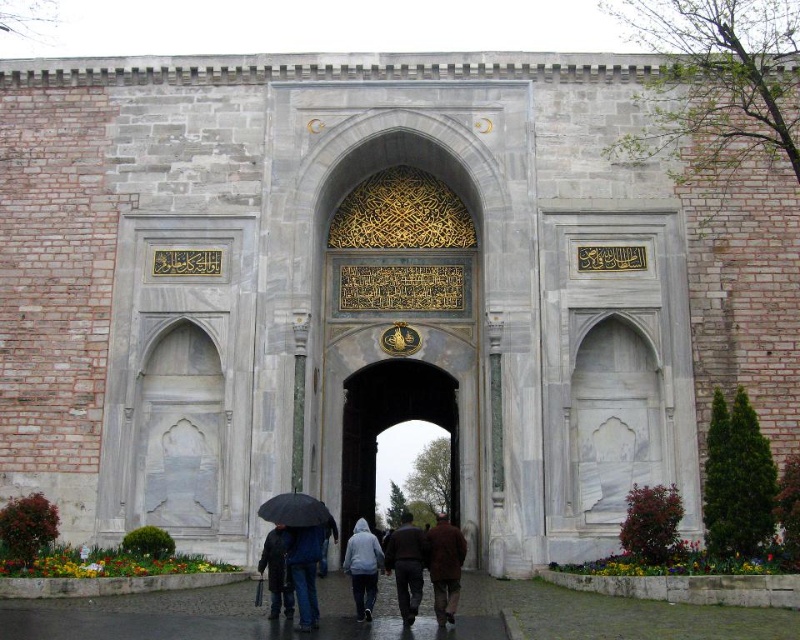
Does point (278, 600) lie in front of point (316, 524)?

No, it is behind (316, 524).

Can you confirm if dark brown leather coat at lower center is thinner than black matte umbrella at lower center?

Yes, dark brown leather coat at lower center is thinner than black matte umbrella at lower center.

Between point (286, 548) and point (277, 499), which one is positioned in front?

Point (286, 548) is more forward.

Image resolution: width=800 pixels, height=640 pixels. Identify the location of dark brown leather coat at lower center. (277, 572).

Does point (458, 381) lie behind point (310, 545)?

That is True.

Between gold metallic gate at center and dark blue jeans at center, which one has more height?

With more height is gold metallic gate at center.

The width and height of the screenshot is (800, 640). What are the coordinates of `gold metallic gate at center` in the screenshot? It's located at (390, 426).

Image resolution: width=800 pixels, height=640 pixels. What are the coordinates of `gold metallic gate at center` in the screenshot? It's located at (390, 426).

Who is higher up, brown leather jacket at center or light gray hoodie at center?

light gray hoodie at center

Which of these two, brown leather jacket at center or light gray hoodie at center, stands shorter?

Standing shorter between the two is light gray hoodie at center.

Describe the element at coordinates (444, 566) in the screenshot. I see `brown leather jacket at center` at that location.

Locate an element on the screen. This screenshot has height=640, width=800. brown leather jacket at center is located at coordinates (444, 566).